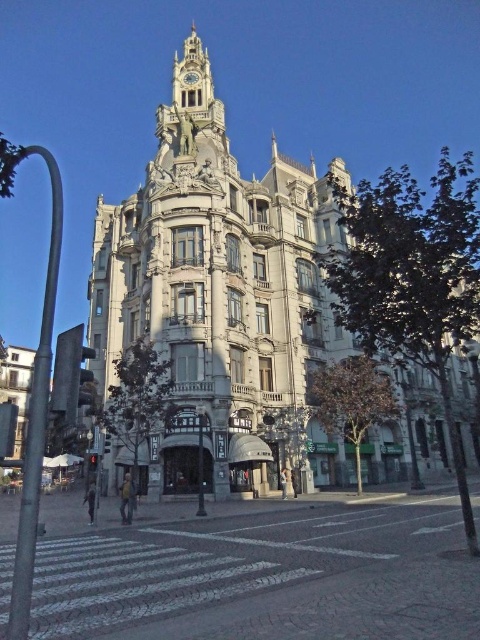
Question: Which object appears closest to the camera in this image?

Choices:
 (A) matte gray building at left
 (B) gold metallic clock at upper center
 (C) gray stone building at center

Answer: (C)

Question: Is gray stone building at center thinner than matte gray building at left?

Choices:
 (A) no
 (B) yes

Answer: (A)

Question: Does gray stone building at center come behind matte gray building at left?

Choices:
 (A) yes
 (B) no

Answer: (B)

Question: Which point is closer to the camera?

Choices:
 (A) (243, 476)
 (B) (189, 77)
 (C) (21, 406)

Answer: (A)

Question: Can you confirm if gray stone building at center is thinner than gold metallic clock at upper center?

Choices:
 (A) yes
 (B) no

Answer: (B)

Question: Among these points, which one is farthest from the camera?

Choices:
 (A) pos(194,74)
 (B) pos(19,420)

Answer: (B)